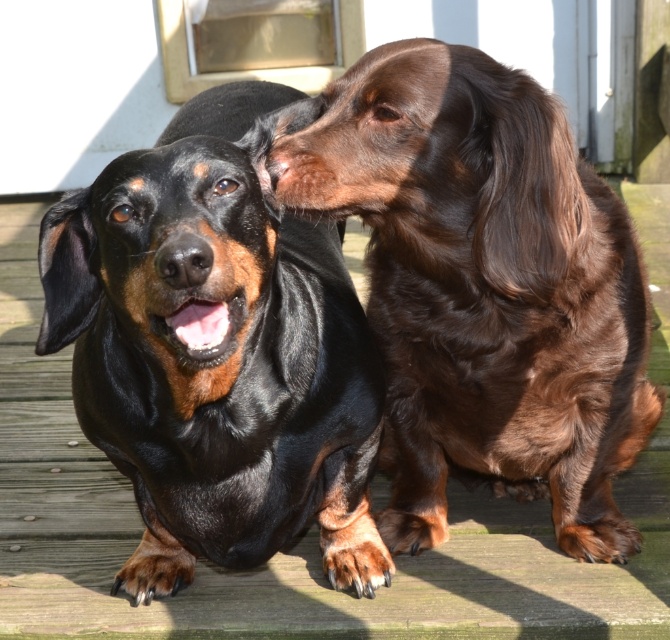
Is point (297, 150) farther from viewer compared to point (299, 236)?

No, (297, 150) is closer to viewer.

Find the location of a particular element. Image resolution: width=670 pixels, height=640 pixels. shiny brown fur at center is located at coordinates (484, 289).